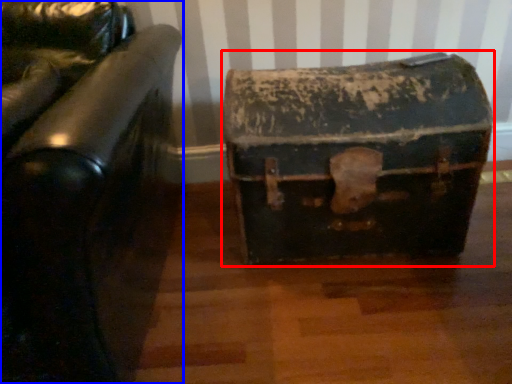
Question: Among these objects, which one is farthest to the camera, suitcase (highlighted by a red box) or furniture (highlighted by a blue box)?

Choices:
 (A) suitcase
 (B) furniture

Answer: (A)